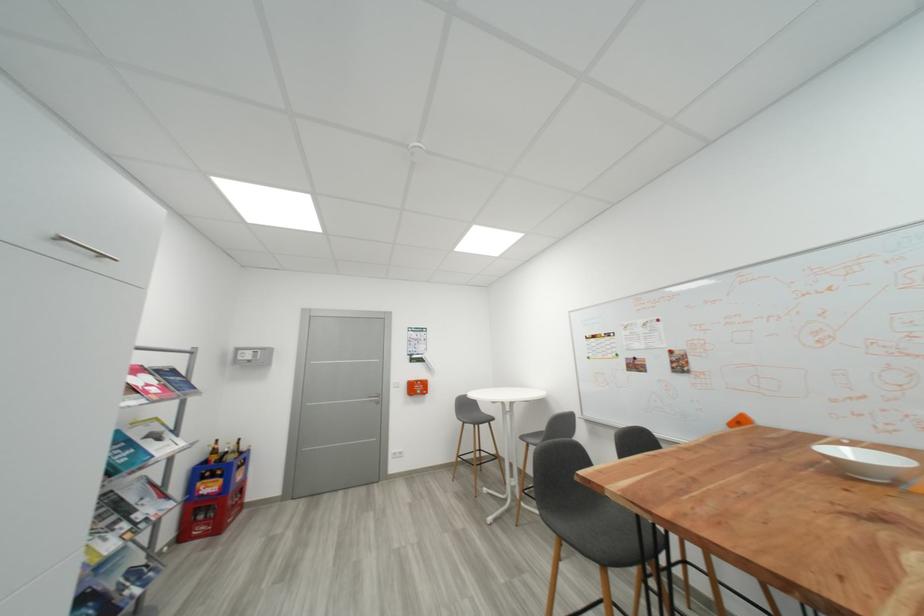
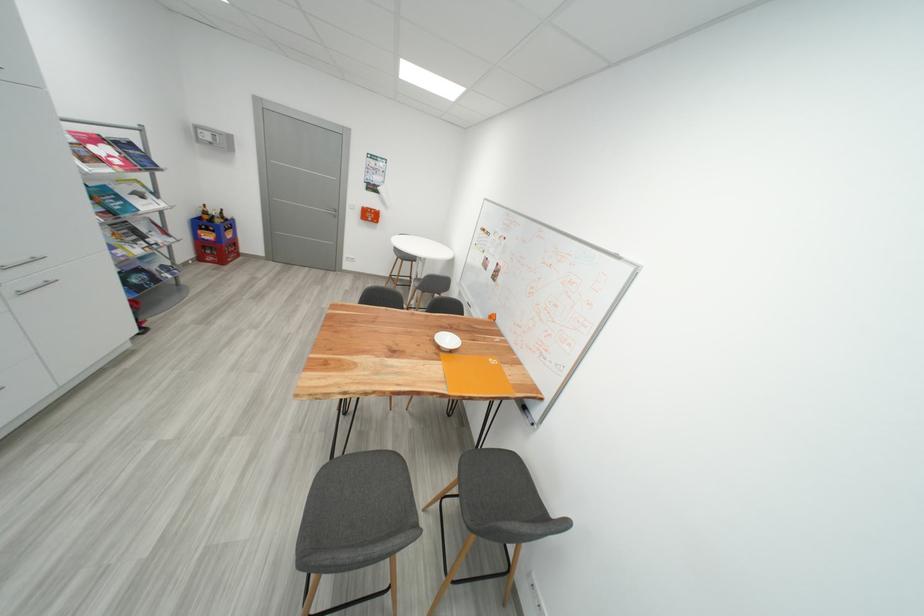
Find the pixel in the second image that matches (x=229, y=450) in the first image.

(220, 214)